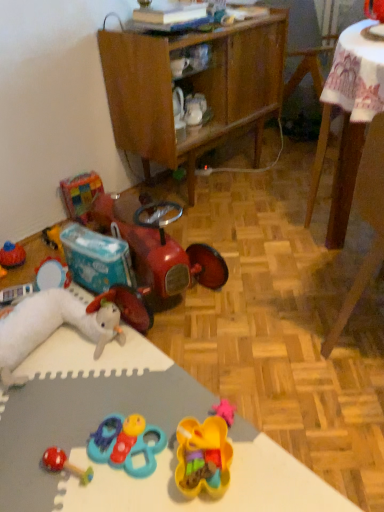
At what (x,y) coordinates should I click in order to perform the action: click on vacant area situated to the left side of wooden chair at lower right. Please return your answer as a coordinate pair (x, y). The height and width of the screenshot is (512, 384). Looking at the image, I should click on (276, 331).